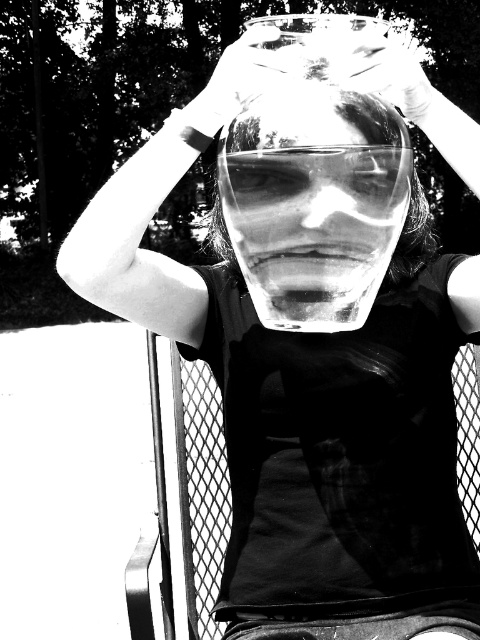
You are a photographer trying to capture the reflection in the transparent glass at center and the translucent plastic hand at upper center. Which object has a greater width in the image?

The transparent glass at center has a greater width than the translucent plastic hand at upper center.

You are a photographer analyzing the image. You notice two points in the scene at coordinates point [228,64] and point [409,80]. Based on the depth perception in the image, which point is closer to the camera?

Point [228,64] is further to the camera than point [409,80], so the closer point to the camera is point [409,80].